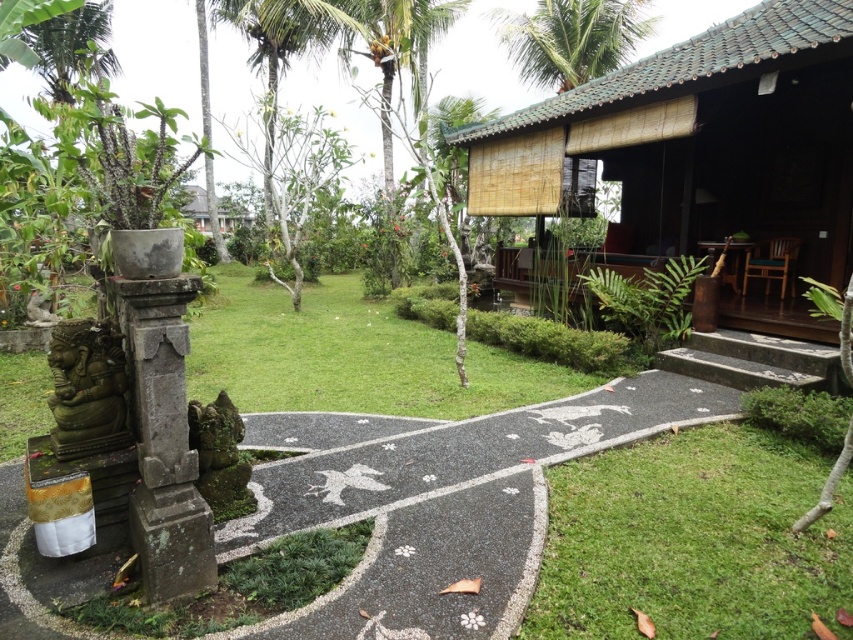
Question: Based on their relative distances, which object is nearer to the green grass at lower right?

Choices:
 (A) green leafy palm tree at upper center
 (B) matte bamboo hut at center

Answer: (B)

Question: Is matte bamboo hut at center bigger than green leafy palm tree at upper center?

Choices:
 (A) no
 (B) yes

Answer: (A)

Question: Observing the image, what is the correct spatial positioning of matte bamboo hut at center in reference to green leafy palm tree at upper center?

Choices:
 (A) above
 (B) below

Answer: (B)

Question: Which point is farther from the camera taking this photo?

Choices:
 (A) (564, 525)
 (B) (576, 44)

Answer: (B)

Question: Can you confirm if matte bamboo hut at center is positioned to the left of green leafy palm tree at upper center?

Choices:
 (A) no
 (B) yes

Answer: (B)

Question: Which of the following is the closest to the observer?

Choices:
 (A) (540, 68)
 (B) (569, 532)

Answer: (B)